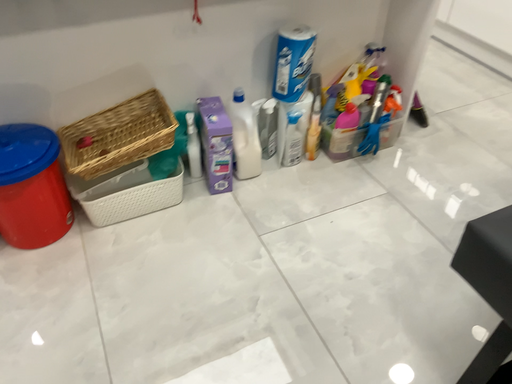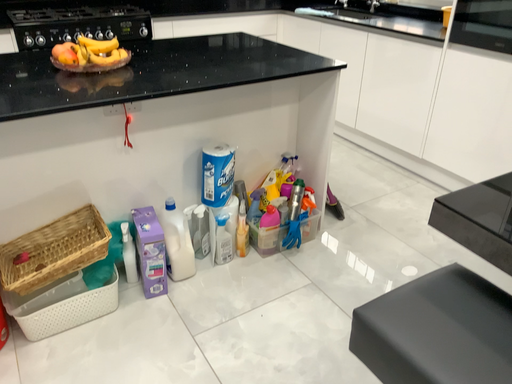
Question: How did the camera likely rotate when shooting the video?

Choices:
 (A) rotated upward
 (B) rotated downward

Answer: (A)